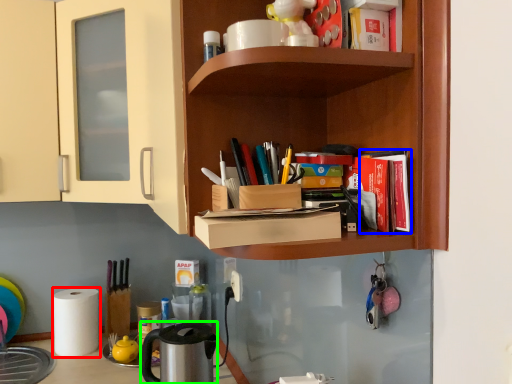
Question: Which is nearer to the paper towel (highlighted by a red box)? book (highlighted by a blue box) or appliance (highlighted by a green box).

Choices:
 (A) book
 (B) appliance

Answer: (B)